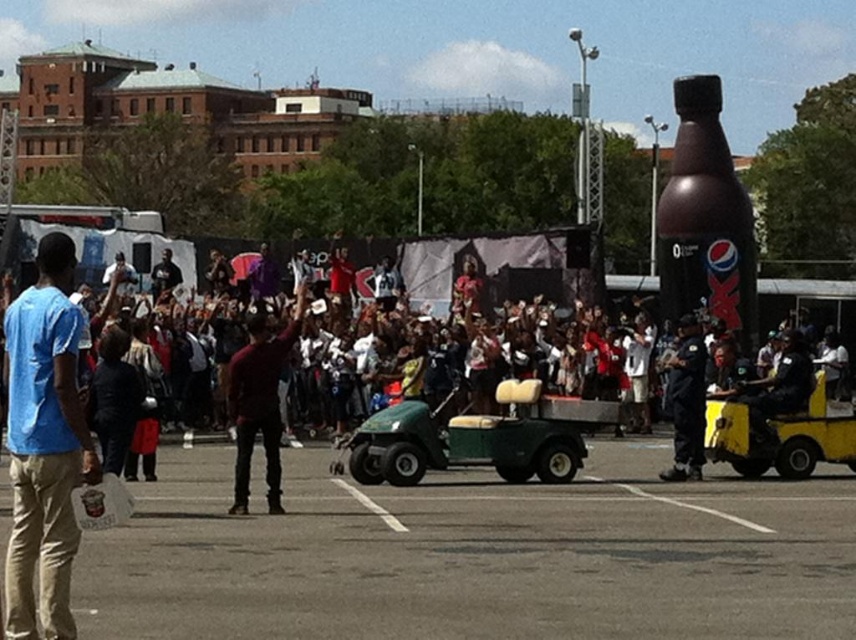
You are a guest at the event and want to reach the black uniformed officer at center to ask for directions. You are currently standing near the yellow plastic cart at right. Which direction should you move to approach the officer?

Since the yellow plastic cart at right is further to the viewer than the black uniformed officer at center, you should move backward or towards the center of the area to approach the officer.

You are planning to take a photo of the blue cotton shirt at left and the black uniformed officer at center. Which of the two objects appears wider in the image?

The blue cotton shirt at left appears wider than the black uniformed officer at center in the image.